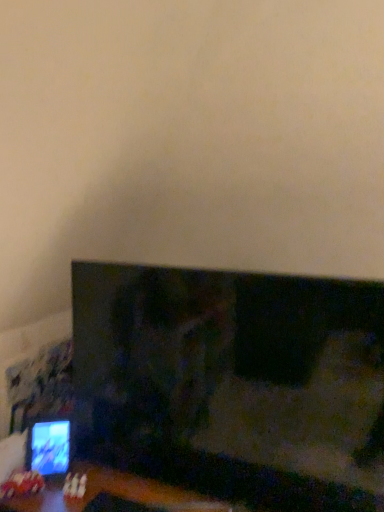
At what (x,y) coordinates should I click in order to perform the action: click on matte black monitor at lower left. Please return your answer as a coordinate pair (x, y). The height and width of the screenshot is (512, 384). Looking at the image, I should click on (48, 447).

What is the approximate width of matte black monitor at lower left?

It is 3.88 inches.

The height and width of the screenshot is (512, 384). Describe the element at coordinates (48, 447) in the screenshot. I see `matte black monitor at lower left` at that location.

Measure the distance between matte black tv at lower left and camera.

The distance of matte black tv at lower left from camera is 1.26 meters.

Describe the element at coordinates (234, 383) in the screenshot. I see `matte black tv at lower left` at that location.

Where is `matte black tv at lower left`? The height and width of the screenshot is (512, 384). matte black tv at lower left is located at coordinates (234, 383).

Where is `matte black monitor at lower left`? Image resolution: width=384 pixels, height=512 pixels. matte black monitor at lower left is located at coordinates (48, 447).

Which is more to the left, matte black monitor at lower left or matte black tv at lower left?

From the viewer's perspective, matte black monitor at lower left appears more on the left side.

Which object is closer to the camera taking this photo, matte black monitor at lower left or matte black tv at lower left?

matte black tv at lower left is more forward.

Is point (28, 461) farther from camera compared to point (183, 396)?

Yes.

From the image's perspective, is matte black monitor at lower left above matte black tv at lower left?

No.

From a real-world perspective, is matte black monitor at lower left physically above matte black tv at lower left?

No, from a real-world perspective, matte black monitor at lower left is not over matte black tv at lower left

Based on the photo, between matte black monitor at lower left and matte black tv at lower left, which one has larger width?

Wider between the two is matte black tv at lower left.

Considering the sizes of objects matte black monitor at lower left and matte black tv at lower left in the image provided, who is shorter, matte black monitor at lower left or matte black tv at lower left?

Standing shorter between the two is matte black monitor at lower left.

Can you confirm if matte black monitor at lower left is bigger than matte black tv at lower left?

No.

Is matte black monitor at lower left outside of matte black tv at lower left?

Yes, matte black monitor at lower left is outside of matte black tv at lower left.

Would you say matte black monitor at lower left is a long distance from matte black tv at lower left?

No, there isn't a large distance between matte black monitor at lower left and matte black tv at lower left.

Is matte black monitor at lower left turned away from matte black tv at lower left?

No, matte black tv at lower left is not at the back of matte black monitor at lower left.

Can you tell me how much matte black monitor at lower left and matte black tv at lower left differ in facing direction?

29.1 degrees separate the facing orientations of matte black monitor at lower left and matte black tv at lower left.

Find the location of a particular element. The width and height of the screenshot is (384, 512). television on the right of matte black monitor at lower left is located at coordinates (234, 383).

In the image, is matte black tv at lower left on the left side or the right side of matte black monitor at lower left?

Clearly, matte black tv at lower left is on the right of matte black monitor at lower left in the image.

Which object is further away from the camera, matte black tv at lower left or matte black monitor at lower left?

matte black monitor at lower left is further away from the camera.

Which is closer to the camera, (380, 443) or (43, 472)?

The point (380, 443) is more forward.

From the image's perspective, between matte black tv at lower left and matte black monitor at lower left, who is located below?

From the image's view, matte black monitor at lower left is below.

From a real-world perspective, who is located lower, matte black tv at lower left or matte black monitor at lower left?

matte black monitor at lower left is physically lower.

Which of these two, matte black tv at lower left or matte black monitor at lower left, is thinner?

matte black monitor at lower left.

From the picture: Considering the sizes of objects matte black tv at lower left and matte black monitor at lower left in the image provided, who is taller, matte black tv at lower left or matte black monitor at lower left?

With more height is matte black tv at lower left.

Considering the sizes of objects matte black tv at lower left and matte black monitor at lower left in the image provided, who is smaller, matte black tv at lower left or matte black monitor at lower left?

With smaller size is matte black monitor at lower left.

Is matte black tv at lower left surrounding matte black monitor at lower left?

No, matte black monitor at lower left is not surrounded by matte black tv at lower left.

Is matte black tv at lower left in contact with matte black monitor at lower left?

No.

Is matte black tv at lower left turned away from matte black monitor at lower left?

No, matte black tv at lower left is not facing away from matte black monitor at lower left.

Measure the distance from matte black tv at lower left to matte black monitor at lower left.

24.35 inches.

The image size is (384, 512). I want to click on computer monitor that appears below the matte black tv at lower left (from a real-world perspective), so click(x=48, y=447).

Locate an element on the screen. The image size is (384, 512). television positioned vertically above the matte black monitor at lower left (from a real-world perspective) is located at coordinates (234, 383).

Locate an element on the screen. computer monitor on the left of matte black tv at lower left is located at coordinates (48, 447).